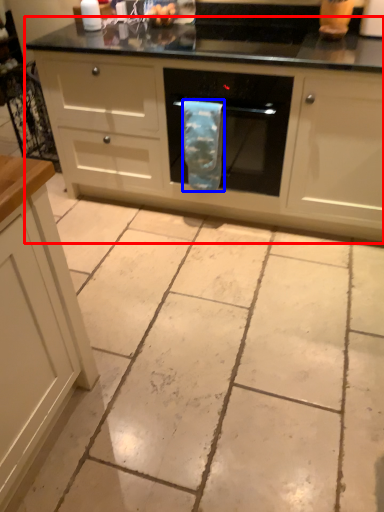
Question: Among these objects, which one is nearest to the camera, oven (highlighted by a red box) or material (highlighted by a blue box)?

Choices:
 (A) oven
 (B) material

Answer: (A)